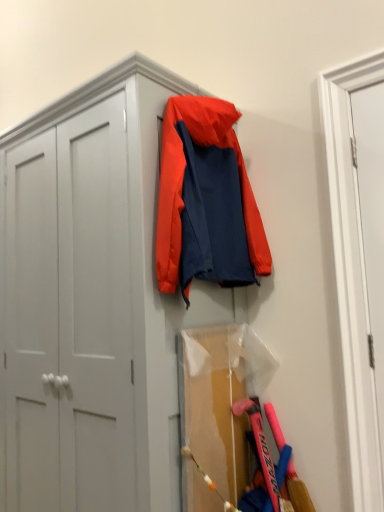
Question: Is white smooth door at right, acting as the 2th door starting from the left, at the left side of orange fabric jacket at center?

Choices:
 (A) no
 (B) yes

Answer: (A)

Question: From the image's perspective, is white smooth door at right, acting as the 2th door starting from the left, over orange fabric jacket at center?

Choices:
 (A) no
 (B) yes

Answer: (A)

Question: From a real-world perspective, is white smooth door at right, which ranks as the first door in right-to-left order, positioned under orange fabric jacket at center based on gravity?

Choices:
 (A) yes
 (B) no

Answer: (A)

Question: Is white smooth door at right, which ranks as the first door in right-to-left order, turned away from orange fabric jacket at center?

Choices:
 (A) yes
 (B) no

Answer: (B)

Question: Can you confirm if white smooth door at right, acting as the 2th door starting from the left, is smaller than orange fabric jacket at center?

Choices:
 (A) no
 (B) yes

Answer: (B)

Question: Looking at the image, does white matte door at right, positioned as the first door in left-to-right order, seem bigger or smaller compared to matte white cabinet at upper left?

Choices:
 (A) small
 (B) big

Answer: (A)

Question: Is point (326, 93) positioned closer to the camera than point (66, 106)?

Choices:
 (A) farther
 (B) closer

Answer: (B)

Question: Is white matte door at right, which is the second door from right to left, taller or shorter than matte white cabinet at upper left?

Choices:
 (A) short
 (B) tall

Answer: (A)

Question: Is white matte door at right, positioned as the first door in left-to-right order, inside or outside of matte white cabinet at upper left?

Choices:
 (A) outside
 (B) inside

Answer: (A)

Question: Is point (168, 88) positioned closer to the camera than point (375, 403)?

Choices:
 (A) farther
 (B) closer

Answer: (A)

Question: From a real-world perspective, relative to white matte door at right, positioned as the first door in left-to-right order, is matte white cabinet at upper left vertically above or below?

Choices:
 (A) above
 (B) below

Answer: (B)

Question: In the image, is matte white cabinet at upper left positioned in front of or behind white matte door at right, positioned as the first door in left-to-right order?

Choices:
 (A) behind
 (B) front

Answer: (B)

Question: Would you say matte white cabinet at upper left is to the left or to the right of white matte door at right, which is the second door from right to left, in the picture?

Choices:
 (A) right
 (B) left

Answer: (B)

Question: Is white matte door at right, which is the second door from right to left, in front of or behind white smooth door at right, acting as the 2th door starting from the left, in the image?

Choices:
 (A) front
 (B) behind

Answer: (A)

Question: Which is correct: white matte door at right, positioned as the first door in left-to-right order, is inside white smooth door at right, which ranks as the first door in right-to-left order, or outside of it?

Choices:
 (A) outside
 (B) inside

Answer: (B)